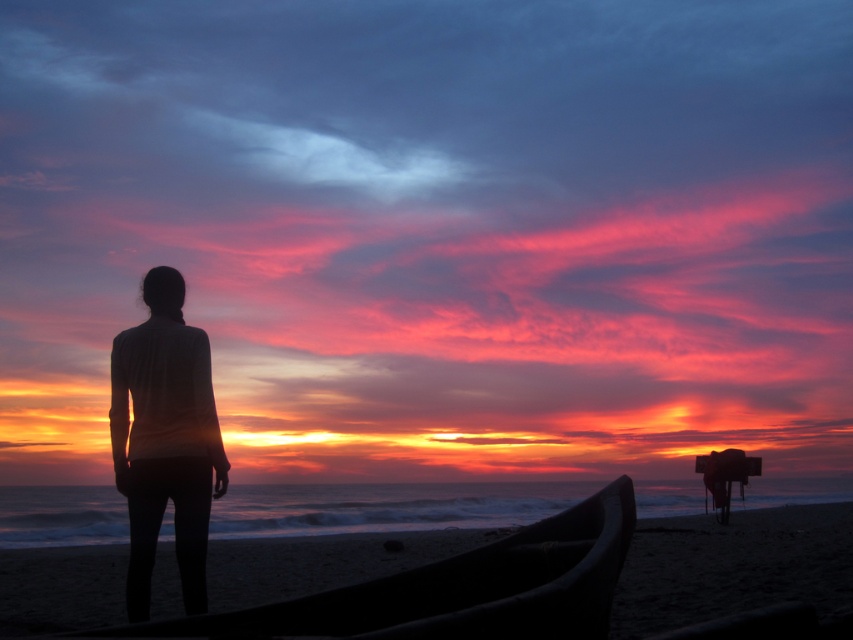
You are standing on the beach and see two points marked in the scene. Which point is closer to you, point (267, 570) or point (155, 428)?

Point (267, 570) is closer to you because it is further to the viewer than point (155, 428).

You are standing on the beach and see the smooth sand at lower left and the silhouette fabric at left. Which object is positioned to the right of the other?

The smooth sand at lower left is positioned to the right of the silhouette fabric at left.